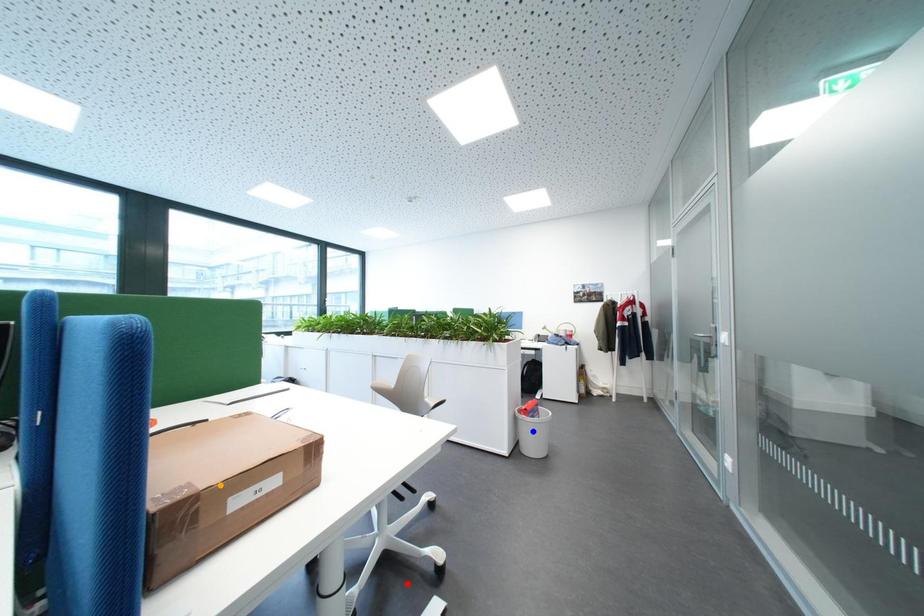
Order these from nearest to farthest:
1. red point
2. blue point
3. orange point

orange point → red point → blue point